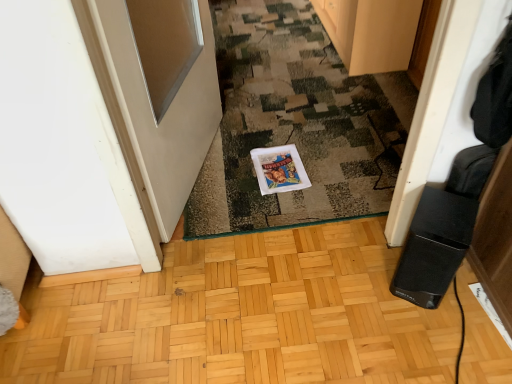
At what (x,y) coordinates should I click in order to perform the action: click on free location above white glossy postcard at center (from a real-world perspective). Please return your answer as a coordinate pair (x, y). This screenshot has height=384, width=512. Looking at the image, I should click on (282, 167).